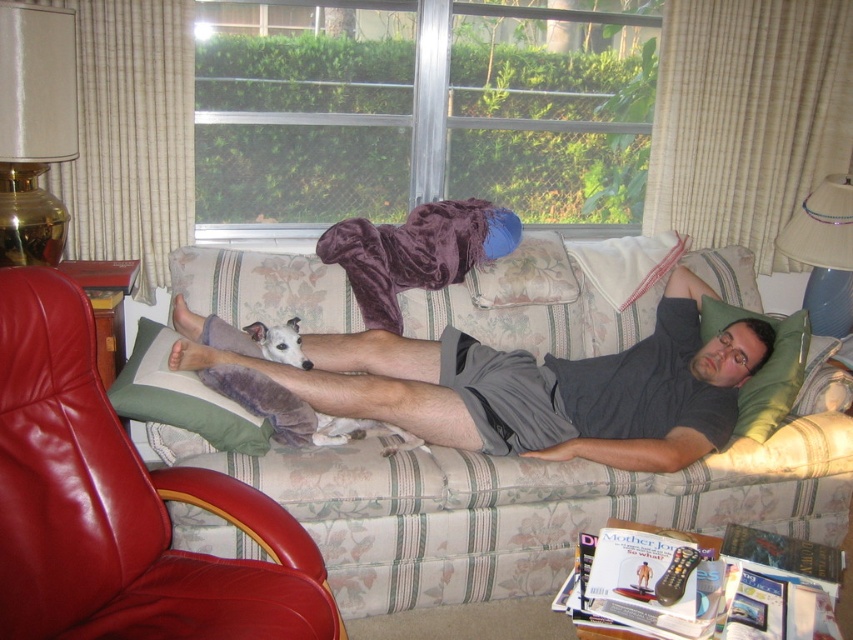
You are a guest in this room and want to sit down. You see the floral fabric couch at center and the leather armchair at lower left. Which one is closer to the window with vertical blinds?

The leather armchair at lower left is behind the floral fabric couch at center, so the floral fabric couch at center is closer to the window with vertical blinds.

You are a photographer trying to capture the gray cotton shorts at center and the white fur dog at center in a single shot. Since the camera can only focus on objects within a certain height range, which object should you prioritize focusing on to ensure it is in clear view?

The gray cotton shorts at center has a greater height compared to the white fur dog at center, so you should prioritize focusing on the gray cotton shorts at center to ensure it is in clear view.